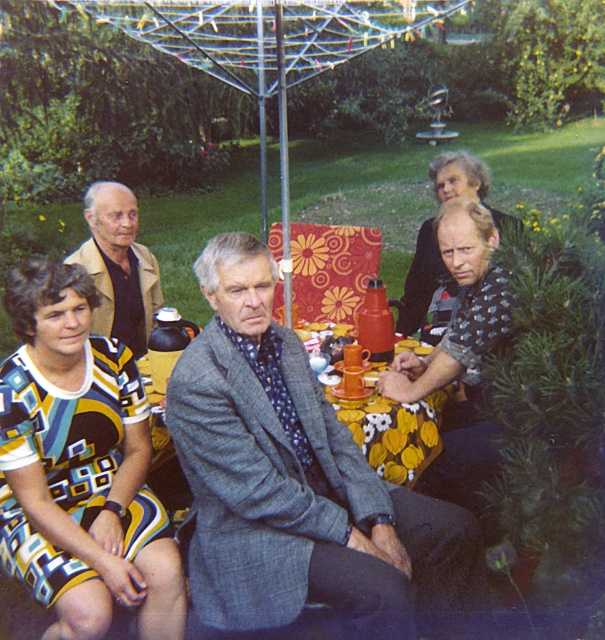
Question: Which object is closer to the camera taking this photo?

Choices:
 (A) light brown leather jacket at upper left
 (B) geometric print dress at lower left
 (C) patterned fabric dress at center

Answer: (B)

Question: Which of these objects is positioned farthest from the light brown leather jacket at upper left?

Choices:
 (A) gray woolen suit at center
 (B) geometric print dress at lower left

Answer: (A)

Question: In this image, where is gray woolen suit at center located relative to light brown leather jacket at upper left?

Choices:
 (A) below
 (B) above

Answer: (A)

Question: Does gray woolen suit at center appear under patterned fabric dress at center?

Choices:
 (A) yes
 (B) no

Answer: (A)

Question: Among these points, which one is farthest from the camera?

Choices:
 (A) (96, 227)
 (B) (266, 531)
 (C) (117, 582)
 (D) (460, 156)

Answer: (D)

Question: Can you confirm if geometric print dress at lower left is smaller than patterned fabric dress at center?

Choices:
 (A) yes
 (B) no

Answer: (B)